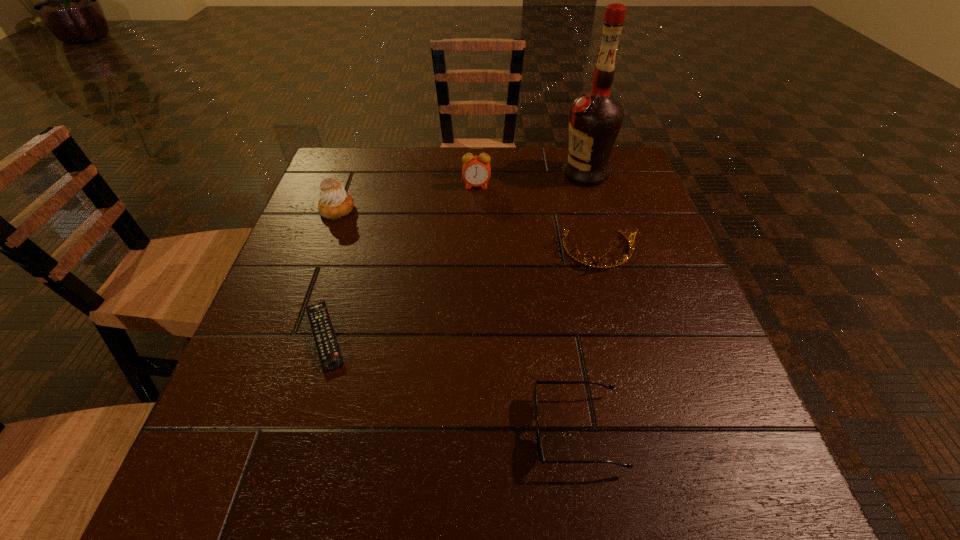
Where is `liquor that is positioned at the far edge`? The image size is (960, 540). liquor that is positioned at the far edge is located at coordinates (595, 119).

Find the location of a particular element. The width and height of the screenshot is (960, 540). alarm clock located at the far edge is located at coordinates (476, 171).

Image resolution: width=960 pixels, height=540 pixels. In order to click on object at the near edge in this screenshot , I will do `click(539, 451)`.

Find the location of a particular element. Image resolution: width=960 pixels, height=540 pixels. pastry present at the left edge is located at coordinates (335, 202).

Identify the location of remote control that is at the left edge. (330, 356).

Identify the location of liquor present at the right edge. (595, 119).

Identify the location of tiara that is at the right edge. This screenshot has width=960, height=540. [615, 263].

Where is `object located at the far right corner`? Image resolution: width=960 pixels, height=540 pixels. object located at the far right corner is located at coordinates (595, 119).

The width and height of the screenshot is (960, 540). In the image, there is a desktop. In order to click on blank space at the far edge in this screenshot , I will do `click(498, 156)`.

Locate an element on the screen. The image size is (960, 540). vacant space at the near edge of the desktop is located at coordinates (639, 468).